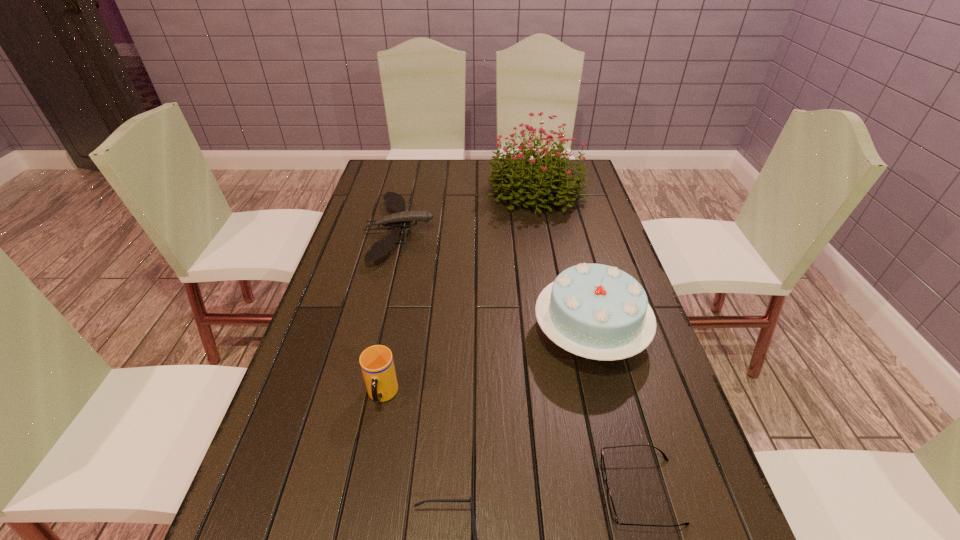
Identify the location of bouquet. (550, 175).

Locate an element on the screen. The width and height of the screenshot is (960, 540). birthday cake is located at coordinates (596, 311).

This screenshot has width=960, height=540. I want to click on the third tallest object, so click(x=377, y=365).

Identify the location of the third shortest object. The height and width of the screenshot is (540, 960). (393, 200).

I want to click on the shortest object, so click(x=609, y=498).

I want to click on the shorter spectacles, so click(x=609, y=498).

Identify the location of free space located 0.080m on the left of the tallest object. (465, 192).

Where is `vacant space located 0.290m on the left of the fifth shortest object`? This screenshot has width=960, height=540. vacant space located 0.290m on the left of the fifth shortest object is located at coordinates (419, 334).

In order to click on vacant area situated 0.130m on the side of the third tallest object with the handle in this screenshot , I will do `click(367, 475)`.

Locate an element on the screen. free spot located 0.370m at the head of the third shortest object is located at coordinates (546, 231).